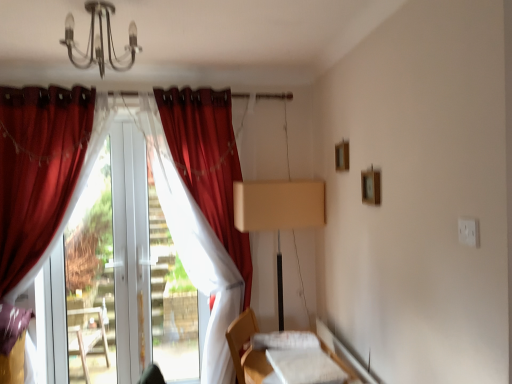
Question: From their relative heights in the image, would you say white fabric at lower right is taller or shorter than matte red curtain at left, which ranks as the 3th curtain in right-to-left order?

Choices:
 (A) tall
 (B) short

Answer: (B)

Question: From the image's perspective, relative to matte red curtain at left, which ranks as the 3th curtain in right-to-left order, is white fabric at lower right above or below?

Choices:
 (A) below
 (B) above

Answer: (A)

Question: Which of these objects is positioned farthest from the white fabric bed at lower center?

Choices:
 (A) red velvet curtain at left, the 2th curtain from the right
 (B) velvet red curtain at left, which appears as the first curtain when viewed from the right
 (C) beige matte table lamp at center
 (D) white fabric at lower right
 (E) transparent plastic window screen at center

Answer: (E)

Question: Which object is the farthest from the beige matte table lamp at center?

Choices:
 (A) metallic chandelier at upper center
 (B) white fabric bed at lower center
 (C) matte red curtain at left, which ranks as the first curtain in left-to-right order
 (D) transparent plastic window screen at center
 (E) velvet red curtain at left, the third curtain from the left

Answer: (C)